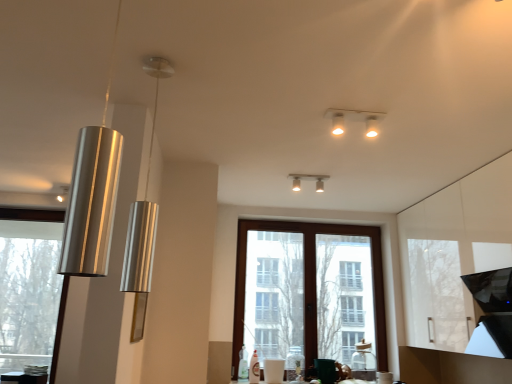
How much space does matte silver light fixture at upper center, which is the 2th lamp from back to front, occupy horizontally?

It is 3.99 inches.

Describe the element at coordinates (143, 211) in the screenshot. The image size is (512, 384). I see `silver/metallic pendant light at left, positioned as the 2th lamp in front-to-back order` at that location.

From the picture: How much space does silver/metallic pendant light at left, positioned as the 2th lamp in front-to-back order, occupy vertically?

silver/metallic pendant light at left, positioned as the 2th lamp in front-to-back order, is 36.28 inches in height.

This screenshot has width=512, height=384. What do you see at coordinates (31, 214) in the screenshot?
I see `clear glass window at left, which ranks as the first window in left-to-right order` at bounding box center [31, 214].

This screenshot has width=512, height=384. Describe the element at coordinates (356, 113) in the screenshot. I see `white glossy light fixture at upper center, placed as the 5th lamp when sorted from left to right` at that location.

How much space does white glossy light fixture at upper center, acting as the first lamp starting from the right, occupy vertically?

4.06 inches.

At what (x,y) coordinates should I click in order to perform the action: click on brown wooden window at center, which ranks as the 1th window in right-to-left order. Please return your answer as a coordinate pair (x, y). This screenshot has height=384, width=512. Looking at the image, I should click on (308, 293).

The height and width of the screenshot is (384, 512). Identify the location of shiny metallic pendant light at left, acting as the 3th lamp starting from the left. tap(92, 195).

This screenshot has height=384, width=512. Identify the location of matte silver light fixture at upper center, positioned as the 4th lamp in front-to-back order. (308, 179).

Based on the photo, can you confirm if brown wooden window at center, which ranks as the 1th window in right-to-left order, is wider than shiny metallic pendant light at left, positioned as the 1th lamp in front-to-back order?

No, brown wooden window at center, which ranks as the 1th window in right-to-left order, is not wider than shiny metallic pendant light at left, positioned as the 1th lamp in front-to-back order.

Considering the sizes of objects brown wooden window at center, which ranks as the 1th window in right-to-left order, and shiny metallic pendant light at left, positioned as the 1th lamp in front-to-back order, in the image provided, who is bigger, brown wooden window at center, which ranks as the 1th window in right-to-left order, or shiny metallic pendant light at left, positioned as the 1th lamp in front-to-back order,?

brown wooden window at center, which ranks as the 1th window in right-to-left order.

Considering the points (361, 317) and (85, 162), which point is in front, point (361, 317) or point (85, 162)?

The point (85, 162) is closer.

From the image's perspective, does brown wooden window at center, which ranks as the 1th window in right-to-left order, appear lower than shiny metallic pendant light at left, the third lamp from the right?

Yes, from the image's perspective, brown wooden window at center, which ranks as the 1th window in right-to-left order, is below shiny metallic pendant light at left, the third lamp from the right.

From the image's perspective, between silver/metallic pendant light at left, which is the 4th lamp in back-to-front order, and clear glass window at left, which ranks as the first window in left-to-right order, which one is located above?

From the image's view, silver/metallic pendant light at left, which is the 4th lamp in back-to-front order, is above.

From a real-world perspective, count 2nd lamps upward from the clear glass window at left, which ranks as the first window in left-to-right order, and point to it. Please provide its 2D coordinates.

[(143, 211)]

What's the angular difference between silver/metallic pendant light at left, which is the 2th lamp from left to right, and clear glass window at left, which ranks as the first window in left-to-right order,'s facing directions?

There is a 88.6-degree angle between the facing directions of silver/metallic pendant light at left, which is the 2th lamp from left to right, and clear glass window at left, which ranks as the first window in left-to-right order.

Would you say silver/metallic pendant light at left, the fourth lamp when ordered from right to left, contains clear glass window at left, which ranks as the second window in right-to-left order?

No, clear glass window at left, which ranks as the second window in right-to-left order, is not a part of silver/metallic pendant light at left, the fourth lamp when ordered from right to left.

From the image's perspective, which is below, brown wooden window at center, which ranks as the 1th window in right-to-left order, or metallic cylinder at left, which appears as the first lamp when viewed from the back?

brown wooden window at center, which ranks as the 1th window in right-to-left order, is shown below in the image.

In the scene shown: Is brown wooden window at center, which ranks as the 1th window in right-to-left order, far from metallic cylinder at left, acting as the fifth lamp starting from the front?

Yes, brown wooden window at center, which ranks as the 1th window in right-to-left order, and metallic cylinder at left, acting as the fifth lamp starting from the front, are located far from each other.

Is metallic cylinder at left, marked as the 1th lamp in a left-to-right arrangement, located within brown wooden window at center, which ranks as the 1th window in right-to-left order?

No, metallic cylinder at left, marked as the 1th lamp in a left-to-right arrangement, is not a part of brown wooden window at center, which ranks as the 1th window in right-to-left order.

Considering the relative sizes of metallic cylinder at left, marked as the 1th lamp in a left-to-right arrangement, and shiny metallic pendant light at left, acting as the 3th lamp starting from the left, in the image provided, is metallic cylinder at left, marked as the 1th lamp in a left-to-right arrangement, taller than shiny metallic pendant light at left, acting as the 3th lamp starting from the left,?

Incorrect, the height of metallic cylinder at left, marked as the 1th lamp in a left-to-right arrangement, is not larger of that of shiny metallic pendant light at left, acting as the 3th lamp starting from the left.

How distant is metallic cylinder at left, acting as the fifth lamp starting from the front, from shiny metallic pendant light at left, the fifth lamp when ordered from back to front?

metallic cylinder at left, acting as the fifth lamp starting from the front, and shiny metallic pendant light at left, the fifth lamp when ordered from back to front, are 9.54 feet apart.

Does metallic cylinder at left, marked as the 1th lamp in a left-to-right arrangement, contain shiny metallic pendant light at left, the fifth lamp when ordered from back to front?

Definitely not — shiny metallic pendant light at left, the fifth lamp when ordered from back to front, is not inside metallic cylinder at left, marked as the 1th lamp in a left-to-right arrangement.

Can you tell me how much metallic cylinder at left, which appears as the 5th lamp when viewed from the right, and shiny metallic pendant light at left, positioned as the 1th lamp in front-to-back order, differ in facing direction?

The angle between the facing direction of metallic cylinder at left, which appears as the 5th lamp when viewed from the right, and the facing direction of shiny metallic pendant light at left, positioned as the 1th lamp in front-to-back order, is 91.9 degrees.

Between white glossy light fixture at upper center, arranged as the third lamp when viewed from the back, and brown wooden window at center, the 2th window when ordered from left to right, which one appears on the left side from the viewer's perspective?

white glossy light fixture at upper center, arranged as the third lamp when viewed from the back.

Which of these two, white glossy light fixture at upper center, placed as the 5th lamp when sorted from left to right, or brown wooden window at center, which ranks as the 1th window in right-to-left order, stands taller?

brown wooden window at center, which ranks as the 1th window in right-to-left order.

Which of these two, white glossy light fixture at upper center, acting as the first lamp starting from the right, or brown wooden window at center, the 2th window when ordered from left to right, is smaller?

white glossy light fixture at upper center, acting as the first lamp starting from the right.

From a real-world perspective, is white glossy light fixture at upper center, marked as the third lamp in a front-to-back arrangement, located beneath brown wooden window at center, which ranks as the 1th window in right-to-left order?

No, from a real-world perspective, white glossy light fixture at upper center, marked as the third lamp in a front-to-back arrangement, is not below brown wooden window at center, which ranks as the 1th window in right-to-left order.

Considering the sizes of objects matte silver light fixture at upper center, the second lamp in the right-to-left sequence, and shiny metallic pendant light at left, positioned as the 1th lamp in front-to-back order, in the image provided, who is shorter, matte silver light fixture at upper center, the second lamp in the right-to-left sequence, or shiny metallic pendant light at left, positioned as the 1th lamp in front-to-back order,?

matte silver light fixture at upper center, the second lamp in the right-to-left sequence.

Between point (326, 175) and point (79, 208), which one is positioned behind?

The point (326, 175) is behind.

Where is `the 3rd lamp in front when counting from the matte silver light fixture at upper center, the 4th lamp from the left`? The width and height of the screenshot is (512, 384). the 3rd lamp in front when counting from the matte silver light fixture at upper center, the 4th lamp from the left is located at coordinates (92, 195).

Does clear glass window at left, which ranks as the second window in right-to-left order, contain shiny metallic pendant light at left, acting as the 3th lamp starting from the left?

Actually, shiny metallic pendant light at left, acting as the 3th lamp starting from the left, is outside clear glass window at left, which ranks as the second window in right-to-left order.

From the image's perspective, is clear glass window at left, which ranks as the first window in left-to-right order, over shiny metallic pendant light at left, acting as the 3th lamp starting from the left?

No, from the image's perspective, clear glass window at left, which ranks as the first window in left-to-right order, is not over shiny metallic pendant light at left, acting as the 3th lamp starting from the left.

Based on the photo, is clear glass window at left, which ranks as the second window in right-to-left order, looking in the opposite direction of shiny metallic pendant light at left, acting as the 3th lamp starting from the left?

No.

Can you see clear glass window at left, which ranks as the first window in left-to-right order, touching shiny metallic pendant light at left, acting as the 3th lamp starting from the left?

clear glass window at left, which ranks as the first window in left-to-right order, and shiny metallic pendant light at left, acting as the 3th lamp starting from the left, are clearly separated.

Find the location of a particular element. Image resolution: width=512 pixels, height=384 pixels. the 3rd lamp to the left when counting from the brown wooden window at center, which ranks as the 1th window in right-to-left order is located at coordinates (92, 195).

Locate an element on the screen. the 1st window behind the silver/metallic pendant light at left, which is the 4th lamp in back-to-front order is located at coordinates (31, 214).

Based on their spatial positions, is metallic cylinder at left, which appears as the 5th lamp when viewed from the right, or silver/metallic pendant light at left, the fourth lamp when ordered from right to left, closer to brown wooden window at center, which ranks as the 1th window in right-to-left order?

Based on the image, metallic cylinder at left, which appears as the 5th lamp when viewed from the right, appears to be nearer to brown wooden window at center, which ranks as the 1th window in right-to-left order.

Estimate the real-world distances between objects in this image. Which object is closer to clear glass window at left, which ranks as the second window in right-to-left order, silver/metallic pendant light at left, the fourth lamp when ordered from right to left, or white glossy light fixture at upper center, placed as the 5th lamp when sorted from left to right?

silver/metallic pendant light at left, the fourth lamp when ordered from right to left, is positioned closer to the anchor clear glass window at left, which ranks as the second window in right-to-left order.

Estimate the real-world distances between objects in this image. Which object is closer to clear glass window at left, which ranks as the first window in left-to-right order, silver/metallic pendant light at left, which is the 2th lamp from left to right, or metallic cylinder at left, which appears as the first lamp when viewed from the back?

Based on the image, metallic cylinder at left, which appears as the first lamp when viewed from the back, appears to be nearer to clear glass window at left, which ranks as the first window in left-to-right order.

From the image, which object appears to be farther from matte silver light fixture at upper center, which is the 2th lamp from back to front, white glossy light fixture at upper center, arranged as the third lamp when viewed from the back, or brown wooden window at center, the 2th window when ordered from left to right?

Among the two, brown wooden window at center, the 2th window when ordered from left to right, is located further to matte silver light fixture at upper center, which is the 2th lamp from back to front.

Consider the image. From the image, which object appears to be farther from metallic cylinder at left, which appears as the 5th lamp when viewed from the right, brown wooden window at center, which ranks as the 1th window in right-to-left order, or matte silver light fixture at upper center, the 4th lamp from the left?

brown wooden window at center, which ranks as the 1th window in right-to-left order.

Which object lies further to the anchor point brown wooden window at center, which ranks as the 1th window in right-to-left order, white glossy light fixture at upper center, marked as the third lamp in a front-to-back arrangement, or metallic cylinder at left, which appears as the 5th lamp when viewed from the right?

metallic cylinder at left, which appears as the 5th lamp when viewed from the right.

Estimate the real-world distances between objects in this image. Which object is closer to shiny metallic pendant light at left, positioned as the 1th lamp in front-to-back order, silver/metallic pendant light at left, which is the 4th lamp in back-to-front order, or brown wooden window at center, the 2th window when ordered from left to right?

silver/metallic pendant light at left, which is the 4th lamp in back-to-front order, is closer to shiny metallic pendant light at left, positioned as the 1th lamp in front-to-back order.

In the scene shown: Estimate the real-world distances between objects in this image. Which object is closer to shiny metallic pendant light at left, the third lamp from the right, metallic cylinder at left, which appears as the first lamp when viewed from the back, or silver/metallic pendant light at left, the fourth lamp when ordered from right to left?

silver/metallic pendant light at left, the fourth lamp when ordered from right to left, lies closer to shiny metallic pendant light at left, the third lamp from the right, than the other object.

In order to click on lamp between silver/metallic pendant light at left, positioned as the 2th lamp in front-to-back order, and matte silver light fixture at upper center, the second lamp in the right-to-left sequence, from front to back in this screenshot , I will do [356, 113].

This screenshot has width=512, height=384. Identify the location of window positioned between silver/metallic pendant light at left, positioned as the 2th lamp in front-to-back order, and metallic cylinder at left, marked as the 1th lamp in a left-to-right arrangement, from near to far. (31, 214).

This screenshot has height=384, width=512. In order to click on lamp between shiny metallic pendant light at left, the third lamp from the right, and white glossy light fixture at upper center, marked as the third lamp in a front-to-back arrangement, in the front-back direction in this screenshot , I will do `click(143, 211)`.

Where is `window between shiny metallic pendant light at left, acting as the 3th lamp starting from the left, and metallic cylinder at left, which appears as the 5th lamp when viewed from the right, along the z-axis`? window between shiny metallic pendant light at left, acting as the 3th lamp starting from the left, and metallic cylinder at left, which appears as the 5th lamp when viewed from the right, along the z-axis is located at coordinates (31, 214).